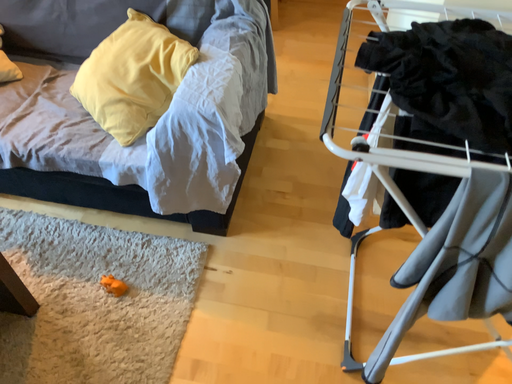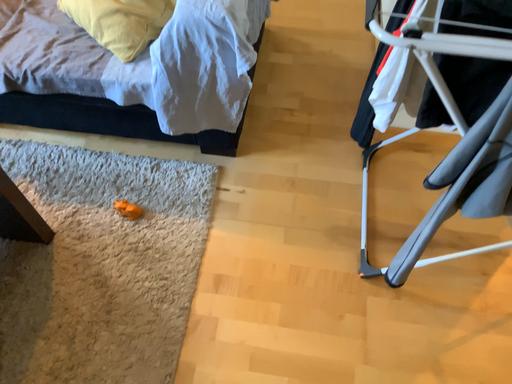
Question: Which way did the camera rotate in the video?

Choices:
 (A) rotated upward
 (B) rotated downward

Answer: (B)